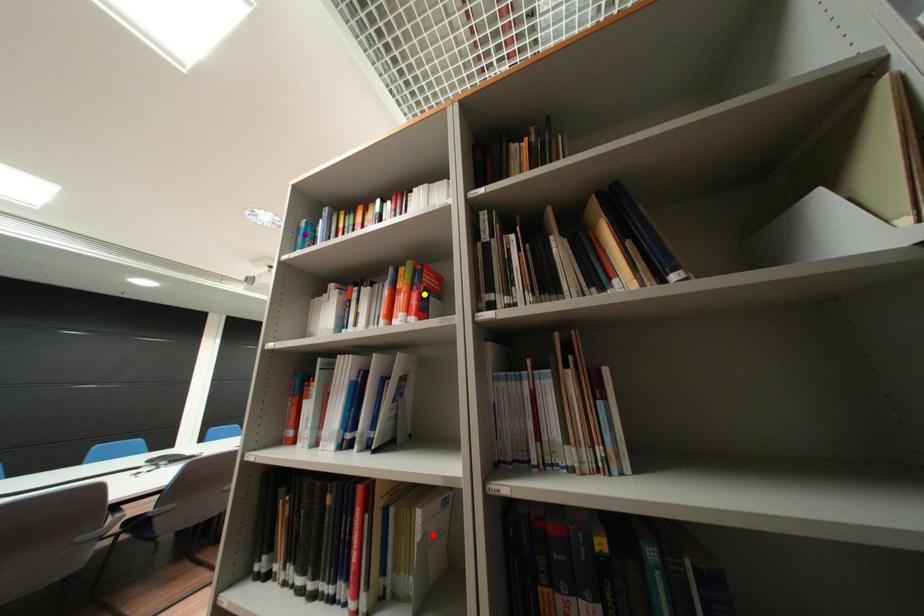
Order these from nearest to farthest:
A) purple point
B) red point
C) yellow point

yellow point < purple point < red point